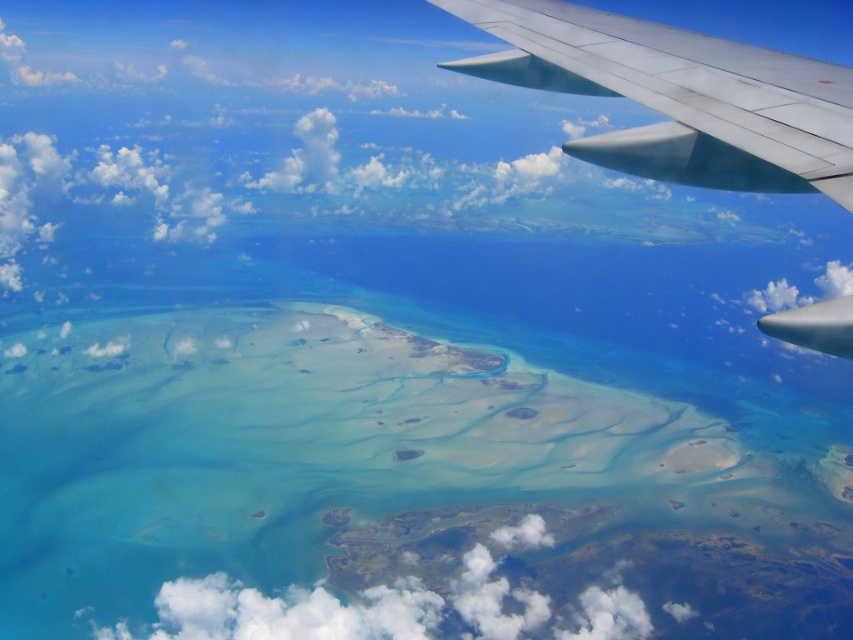
In the scene shown: You are a passenger on an airplane and notice a point marked at coordinates (399, 488) through the window. Based on the scene, what type of landform is located at that point?

The point at coordinates (399, 488) is on a translucent sandbar at center.

You are a pilot flying over the ocean and notice the translucent sandbar at center and the white fluffy cloud at center. Which object is closer to you based on their positions?

The translucent sandbar at center is closer to you because it is positioned over the white fluffy cloud at center, indicating it is in a lower altitude.

You are a passenger on the airplane and looking out the window. You see two points marked on the wing. The first is at point (x=230, y=324) and the second at point (x=544, y=545). Which point is closer to you?

Point (x=230, y=324) is closer to you because it is further to the viewer than point (x=544, y=545).